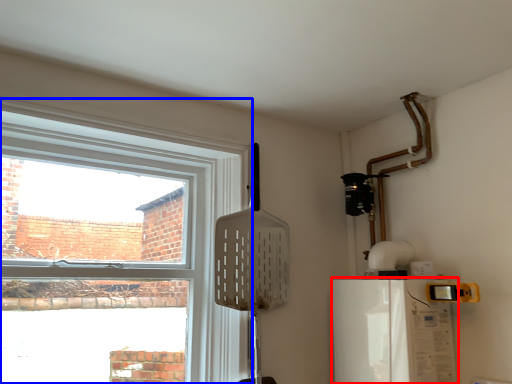
Question: Which object appears closest to the camera in this image, appliance (highlighted by a red box) or window (highlighted by a blue box)?

Choices:
 (A) appliance
 (B) window

Answer: (B)